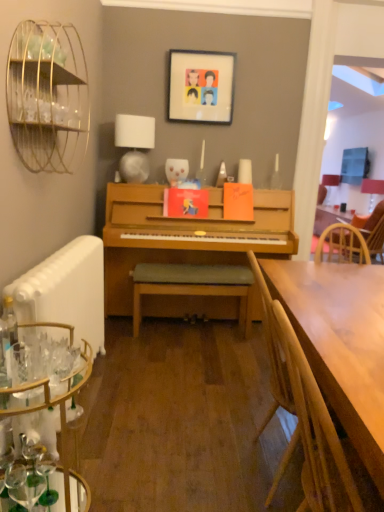
Describe the element at coordinates (201, 86) in the screenshot. I see `matte plastic picture frame at upper center` at that location.

The width and height of the screenshot is (384, 512). I want to click on white matte radiator at lower left, so click(x=66, y=291).

At what (x,y) coordinates should I click in order to perform the action: click on wooden chair at right, which appears as the 2th chair when viewed from the top. Please return your answer as a coordinate pair (x, y). The height and width of the screenshot is (512, 384). Looking at the image, I should click on (300, 406).

What do you see at coordinates (134, 145) in the screenshot? I see `white fabric lampshade at upper center, placed as the 2th lamp when sorted from back to front` at bounding box center [134, 145].

Image resolution: width=384 pixels, height=512 pixels. Identify the location of wooden chair at right, which is the first chair from right to left. (356, 237).

The width and height of the screenshot is (384, 512). Find the location of `wooden bench at center`. wooden bench at center is located at coordinates (193, 286).

The width and height of the screenshot is (384, 512). Identify the location of matte plastic picture frame at upper center. (201, 86).

Between wooden chair at right, the first chair in the left-to-right sequence, and white fabric lampshade at upper center, the first lamp in the front-to-back sequence, which one appears on the left side from the viewer's perspective?

white fabric lampshade at upper center, the first lamp in the front-to-back sequence, is more to the left.

Between wooden chair at right, the second chair from the back, and white fabric lampshade at upper center, the first lamp in the front-to-back sequence, which one has more height?

wooden chair at right, the second chair from the back, is taller.

Is wooden chair at right, which appears as the first chair when ordered from the bottom, far away from white fabric lampshade at upper center, the first lamp in the front-to-back sequence?

Yes, wooden chair at right, which appears as the first chair when ordered from the bottom, and white fabric lampshade at upper center, the first lamp in the front-to-back sequence, are quite far apart.

From a real-world perspective, which object rests below the other?

wooden chair at right, which appears as the first chair when viewed from the front.

Does clear glass desk at lower left appear on the right side of gold wire birdcage at upper left?

Indeed, clear glass desk at lower left is positioned on the right side of gold wire birdcage at upper left.

Could you tell me if clear glass desk at lower left is facing gold wire birdcage at upper left?

No, clear glass desk at lower left is not aimed at gold wire birdcage at upper left.

From a real-world perspective, is clear glass desk at lower left beneath gold wire birdcage at upper left?

Yes, from a real-world perspective, clear glass desk at lower left is under gold wire birdcage at upper left.

Is clear glass desk at lower left far away from gold wire birdcage at upper left?

That's right, there is a large distance between clear glass desk at lower left and gold wire birdcage at upper left.

From a real-world perspective, which is physically above, clear glass bottle at left or wooden bench at center?

clear glass bottle at left.

Is clear glass bottle at left to the left or to the right of wooden bench at center in the image?

In the image, clear glass bottle at left appears on the left side of wooden bench at center.

Between clear glass bottle at left and wooden bench at center, which one has smaller width?

clear glass bottle at left.

Find the location of a particular element. bar stool below the clear glass bottle at left (from the image's perspective) is located at coordinates (193, 286).

Find the location of a particular element. The width and height of the screenshot is (384, 512). the 2nd lamp located beneath the gold wire birdcage at upper left (from a real-world perspective) is located at coordinates (372, 190).

From a real-world perspective, between gold wire birdcage at upper left and matte white lampshade at upper right, which is counted as the 1th lamp, starting from the back, who is vertically higher?

gold wire birdcage at upper left.

Is gold wire birdcage at upper left situated inside matte white lampshade at upper right, which is counted as the 1th lamp, starting from the back, or outside?

gold wire birdcage at upper left is not enclosed by matte white lampshade at upper right, which is counted as the 1th lamp, starting from the back.

Does point (61, 91) appear closer or farther from the camera than point (382, 186)?

Point (61, 91).

Is point (363, 181) farther from viewer compared to point (65, 397)?

Yes, point (363, 181) is farther from viewer.

Considering the sizes of objects matte white lampshade at upper right, which is counted as the second lamp, starting from the left, and clear glass desk at lower left in the image provided, who is smaller, matte white lampshade at upper right, which is counted as the second lamp, starting from the left, or clear glass desk at lower left?

matte white lampshade at upper right, which is counted as the second lamp, starting from the left, is smaller.

From the image's perspective, between matte white lampshade at upper right, which is counted as the second lamp, starting from the left, and clear glass desk at lower left, which one is located above?

matte white lampshade at upper right, which is counted as the second lamp, starting from the left, is shown above in the image.

Is point (63, 462) more distant than point (240, 302)?

No, (63, 462) is closer to viewer.

Identify the location of desk located below the wooden bench at center (from the image's perspective). The width and height of the screenshot is (384, 512). (54, 405).

In the scene shown: Is clear glass desk at lower left not close to wooden bench at center?

Absolutely, clear glass desk at lower left is distant from wooden bench at center.

Could you tell me if clear glass desk at lower left is turned towards wooden bench at center?

No, clear glass desk at lower left is not aimed at wooden bench at center.

Looking at their sizes, would you say clear glass bottle at left is wider or thinner than white fabric lampshade at upper center, the first lamp in the front-to-back sequence?

Considering their sizes, clear glass bottle at left looks slimmer than white fabric lampshade at upper center, the first lamp in the front-to-back sequence.

Can you confirm if clear glass bottle at left is bigger than white fabric lampshade at upper center, the first lamp in the front-to-back sequence?

Actually, clear glass bottle at left might be smaller than white fabric lampshade at upper center, the first lamp in the front-to-back sequence.

From the image's perspective, is clear glass bottle at left above or below white fabric lampshade at upper center, which ranks as the 2th lamp in right-to-left order?

Based on their image positions, clear glass bottle at left is located beneath white fabric lampshade at upper center, which ranks as the 2th lamp in right-to-left order.

Which is behind, point (1, 375) or point (128, 136)?

Positioned behind is point (128, 136).

Where is `lamp on the left of wooden chair at right, which appears as the first chair when ordered from the bottom`? The width and height of the screenshot is (384, 512). lamp on the left of wooden chair at right, which appears as the first chair when ordered from the bottom is located at coordinates (134, 145).

Find the location of `bird cage above the clear glass desk at lower left (from a real-world perspective)`. bird cage above the clear glass desk at lower left (from a real-world perspective) is located at coordinates (48, 96).

Looking at this image, looking at the image, which one is located closer to white fabric lampshade at upper center, placed as the 2th lamp when sorted from back to front, white matte radiator at lower left or clear glass bottle at left?

The object closer to white fabric lampshade at upper center, placed as the 2th lamp when sorted from back to front, is white matte radiator at lower left.

Looking at this image, when comparing their distances from white fabric lampshade at upper center, placed as the 2th lamp when sorted from back to front, does clear glass desk at lower left or wooden bench at center seem closer?

The object closer to white fabric lampshade at upper center, placed as the 2th lamp when sorted from back to front, is wooden bench at center.

Considering their positions, is wooden bench at center positioned closer to clear glass bottle at left than matte white lampshade at upper right, the 2th lamp positioned from the front?

wooden bench at center.

Based on their spatial positions, is white fabric lampshade at upper center, which ranks as the 2th lamp in right-to-left order, or clear glass desk at lower left closer to clear glass bottle at left?

Among the two, clear glass desk at lower left is located nearer to clear glass bottle at left.

Looking at the image, which one is located closer to white matte radiator at lower left, wooden chair at right, the 2th chair from the front, or wooden chair at right, the second chair from the back?

wooden chair at right, the second chair from the back, is positioned closer to the anchor white matte radiator at lower left.

Estimate the real-world distances between objects in this image. Which object is closer to wooden chair at right, which appears as the 2th chair when viewed from the top, matte white lampshade at upper right, the 2th lamp positioned from the front, or white fabric lampshade at upper center, the first lamp in the front-to-back sequence?

white fabric lampshade at upper center, the first lamp in the front-to-back sequence, lies closer to wooden chair at right, which appears as the 2th chair when viewed from the top, than the other object.

Estimate the real-world distances between objects in this image. Which object is further from wooden chair at right, placed as the second chair when sorted from bottom to top, wooden chair at right, which appears as the first chair when ordered from the bottom, or wooden bench at center?

wooden chair at right, which appears as the first chair when ordered from the bottom, is further to wooden chair at right, placed as the second chair when sorted from bottom to top.

Looking at the image, which one is located closer to white fabric lampshade at upper center, which ranks as the 2th lamp in right-to-left order, matte white lampshade at upper right, which is counted as the second lamp, starting from the left, or gold wire birdcage at upper left?

gold wire birdcage at upper left is closer to white fabric lampshade at upper center, which ranks as the 2th lamp in right-to-left order.

This screenshot has height=512, width=384. In order to click on radiator located between clear glass bottle at left and wooden chair at right, the second chair from the left, in the depth direction in this screenshot , I will do `click(66, 291)`.

In order to click on picture frame located between white matte radiator at lower left and wooden chair at right, which is the first chair from right to left, in the depth direction in this screenshot , I will do (x=201, y=86).

Locate an element on the screen. This screenshot has height=512, width=384. radiator between gold wire birdcage at upper left and white fabric lampshade at upper center, placed as the 2th lamp when sorted from back to front, in the front-back direction is located at coordinates (66, 291).

Identify the location of chair located between matte plastic picture frame at upper center and matte white lampshade at upper right, which is counted as the second lamp, starting from the left, in the depth direction. (356, 237).